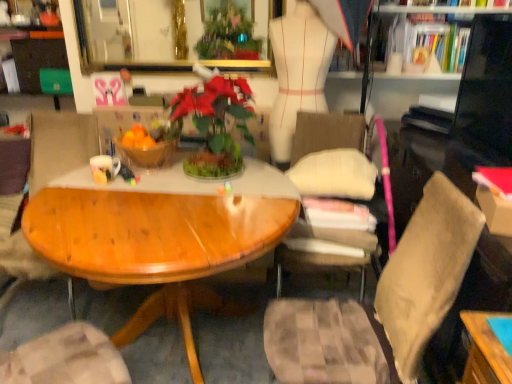
Question: In terms of size, does red paper book at right, which is the 3th book from top to bottom, appear bigger or smaller than wooden bowl at center?

Choices:
 (A) small
 (B) big

Answer: (A)

Question: Is red paper book at right, which appears as the first book when viewed from the front, in front of or behind wooden bowl at center in the image?

Choices:
 (A) front
 (B) behind

Answer: (A)

Question: Based on their relative distances, which object is nearer to the wooden bowl at center?

Choices:
 (A) red paper book at right, which appears as the first book when viewed from the front
 (B) wooden chair at left, which is counted as the 2th chair, starting from the right
 (C) green matte houseplant at center
 (D) hardcover book at upper right, the 1th book when ordered from top to bottom
 (E) glossy wood table at center

Answer: (C)

Question: Considering the real-world distances, which object is farthest from the glossy wood table at center?

Choices:
 (A) red paper book at right, the third book in the back-to-front sequence
 (B) matte white mug at center-left
 (C) hardcover book at upper right, arranged as the 3th book when ordered from the bottom
 (D) wooden bowl at center
 (E) white paper book at upper right, which is the 1th book from back to front

Answer: (E)